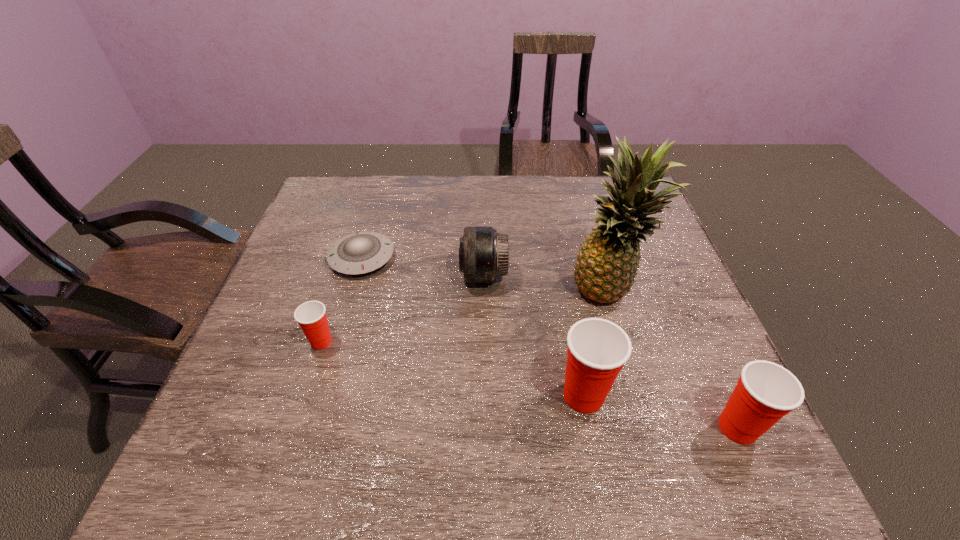
Find the location of a particular element. This screenshot has height=540, width=960. vacant space that satisfies the following two spatial constraints: 1. on the front-facing side of the rightmost Dixie cup; 2. on the left side of the third object from left to right is located at coordinates (485, 428).

Where is `vacant region that satisfies the following two spatial constraints: 1. on the front-facing side of the third object from left to right; 2. on the right side of the pineapple`? The image size is (960, 540). vacant region that satisfies the following two spatial constraints: 1. on the front-facing side of the third object from left to right; 2. on the right side of the pineapple is located at coordinates (484, 292).